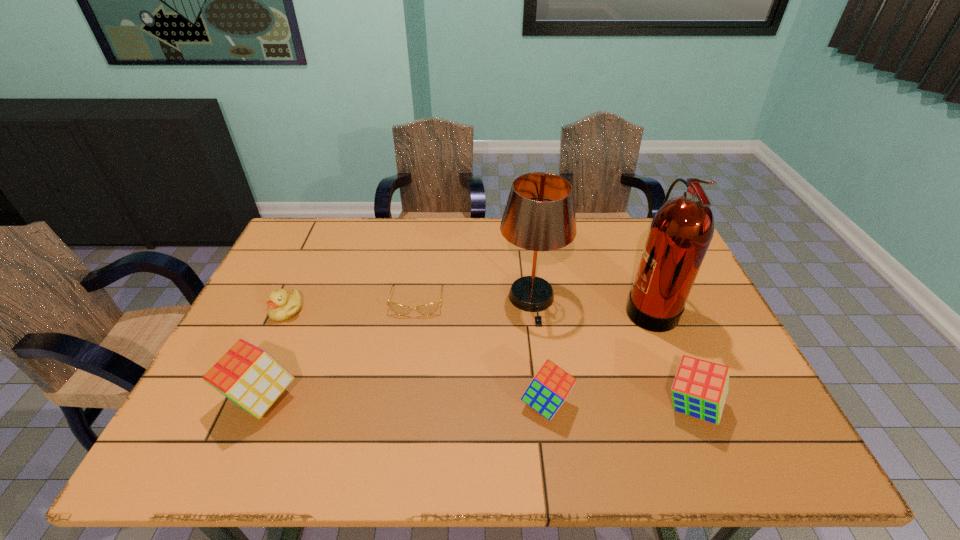
Please point a space for a new cube to maintain equal intervals. Please provide its 2D coordinates. Your answer should be formatted as a tuple, i.e. [(x, y)], where the tuple contains the x and y coordinates of a point satisfying the conditions above.

[(402, 401)]